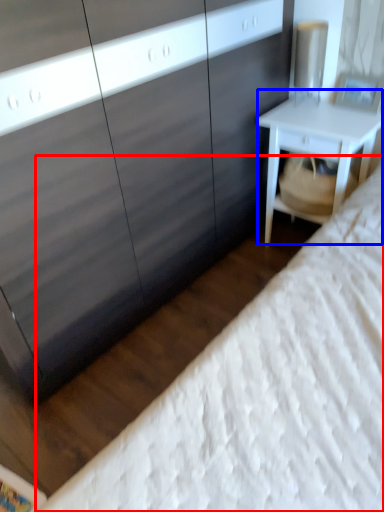
Question: Which point is closer to the camera, bed (highlighted by a red box) or nightstand (highlighted by a blue box)?

Choices:
 (A) bed
 (B) nightstand

Answer: (A)